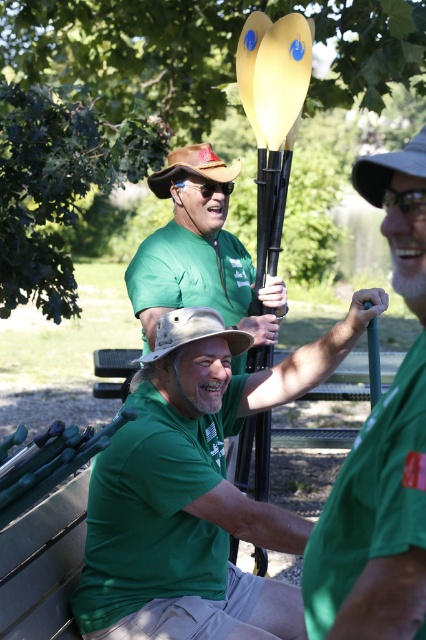
Question: Which point is closer to the camera taking this photo?

Choices:
 (A) (253, 394)
 (B) (362, 568)

Answer: (B)

Question: Does green matte kayak paddle at center come in front of green matte kayak paddle at right?

Choices:
 (A) no
 (B) yes

Answer: (A)

Question: Observing the image, what is the correct spatial positioning of green matte kayak paddle at center in reference to green matte kayak paddle at right?

Choices:
 (A) above
 (B) below

Answer: (B)

Question: Is green matte kayak paddle at center closer to the viewer compared to green matte kayak paddle at right?

Choices:
 (A) yes
 (B) no

Answer: (B)

Question: Which point is closer to the camera?

Choices:
 (A) green matte kayak paddle at center
 (B) green matte kayak paddle at right

Answer: (B)